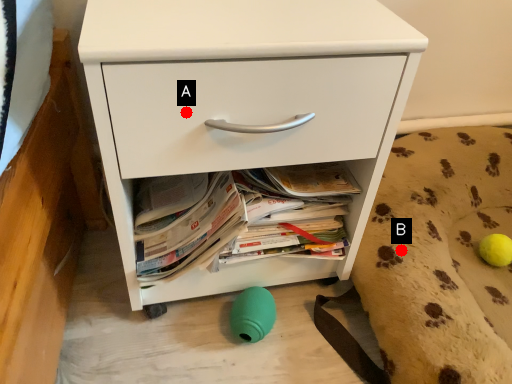
Question: Two points are circled on the image, labeled by A and B beside each circle. Which point is closer to the camera?

Choices:
 (A) A is closer
 (B) B is closer

Answer: (A)